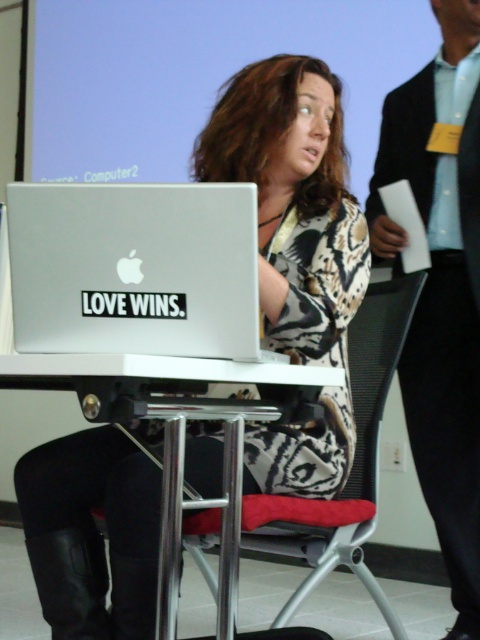
You are attending a virtual meeting and need to adjust your camera to ensure the matte silver laptop at center is clearly visible. Considering the laptop is 4.58 feet away from your camera, what is the minimum distance you should maintain between your camera and the laptop to ensure it fits within the frame?

The minimum distance you should maintain between your camera and the matte silver laptop at center is 4.58 feet to ensure it fits within the frame.